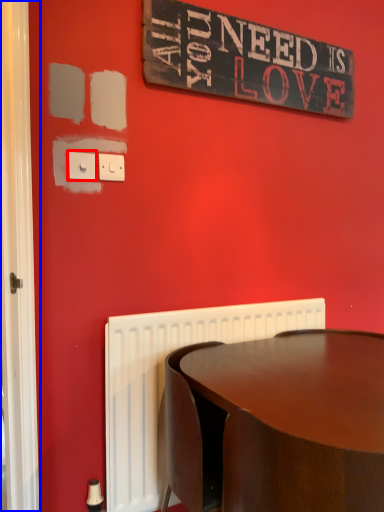
Question: Which of the following is the farthest to the observer, electric outlet (highlighted by a red box) or screen door (highlighted by a blue box)?

Choices:
 (A) electric outlet
 (B) screen door

Answer: (A)